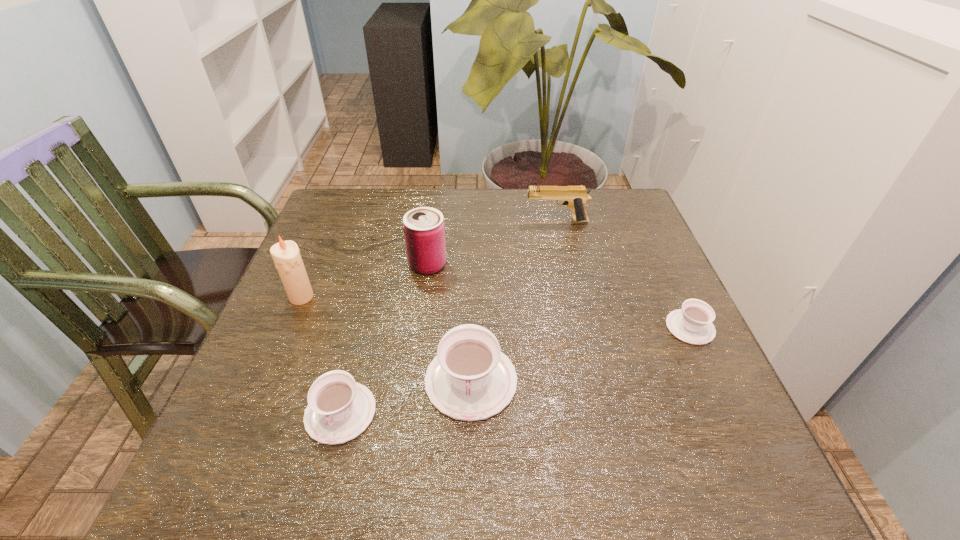
This screenshot has width=960, height=540. In the image, there is a desktop. Find the location of `vacant space at the right edge`. vacant space at the right edge is located at coordinates (626, 238).

Find the location of a particular element. The image size is (960, 540). vacant space at the near right corner of the desktop is located at coordinates (723, 422).

Locate an element on the screen. The height and width of the screenshot is (540, 960). free space between the tallest teacup and the shortest teacup is located at coordinates (581, 354).

At what (x,y) coordinates should I click in order to perform the action: click on free space between the fourth tallest object and the fourth nearest object. Please return your answer as a coordinate pair (x, y). Looking at the image, I should click on (386, 339).

The height and width of the screenshot is (540, 960). What are the coordinates of `free space between the fifth shortest object and the second teacup from right to left` in the screenshot? It's located at (449, 322).

Identify the location of vacant space in between the farthest object and the third shortest object. The height and width of the screenshot is (540, 960). (514, 301).

I want to click on vacant point located between the tallest object and the third shortest object, so click(x=386, y=339).

You are a GUI agent. You are given a task and a screenshot of the screen. Output one action in this format:
    pyautogui.click(x=<x>, y=<y>)
    Task: Click on the free spot between the rightmost teacup and the tallest object
    The width and height of the screenshot is (960, 540).
    Given the screenshot: What is the action you would take?
    click(495, 312)

You are a GUI agent. You are given a task and a screenshot of the screen. Output one action in this format:
    pyautogui.click(x=<x>, y=<y>)
    Task: Click on the vacant area that lies between the shortest object and the second teacup from left to right
    
    Given the screenshot: What is the action you would take?
    pyautogui.click(x=581, y=354)

At what (x,y) coordinates should I click in order to perform the action: click on vacant point located between the can and the rightmost object. Please return your answer as a coordinate pair (x, y). The image size is (960, 540). Looking at the image, I should click on (559, 296).